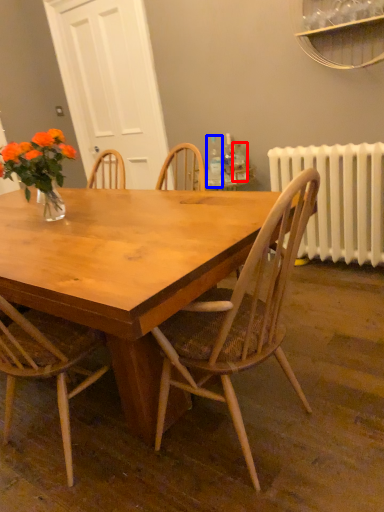
Question: Which object is further to the camera taking this photo, bottle (highlighted by a red box) or bottle (highlighted by a blue box)?

Choices:
 (A) bottle
 (B) bottle

Answer: (A)